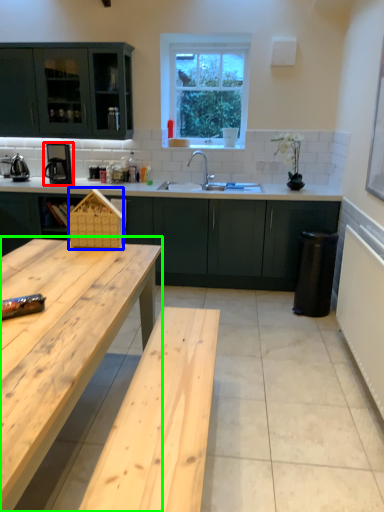
Question: Which is nearer to the coffee machine (highlighted by a red box)? basket (highlighted by a blue box) or table (highlighted by a green box).

Choices:
 (A) basket
 (B) table

Answer: (A)